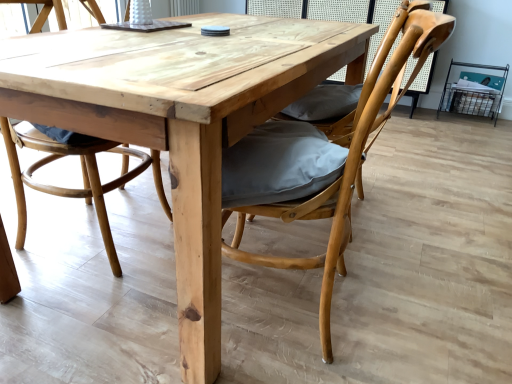
Question: Based on their positions, is natural wood table at center located to the left or right of natural wood chair at center, the 2th chair viewed from the right?

Choices:
 (A) left
 (B) right

Answer: (B)

Question: From their relative heights in the image, would you say natural wood table at center is taller or shorter than natural wood chair at center, the first chair when ordered from left to right?

Choices:
 (A) tall
 (B) short

Answer: (B)

Question: Estimate the real-world distances between objects in this image. Which object is closer to the natural wood chair at center, which is counted as the second chair, starting from the left?

Choices:
 (A) natural wood table at center
 (B) natural wood chair at center, the 2th chair viewed from the right

Answer: (A)

Question: Which of these objects is positioned farthest from the natural wood chair at center, which appears as the first chair when viewed from the right?

Choices:
 (A) natural wood table at center
 (B) natural wood chair at center, the 2th chair viewed from the right

Answer: (B)